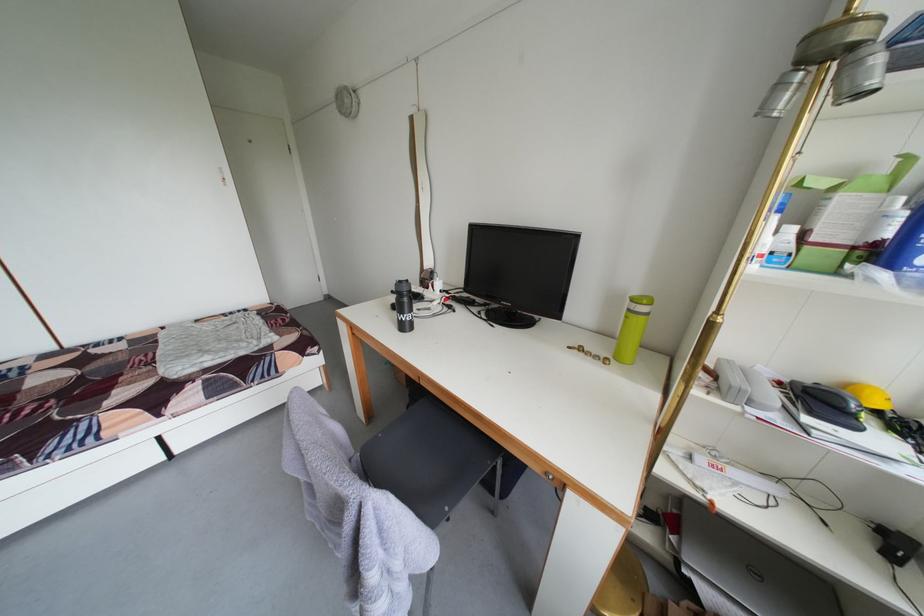
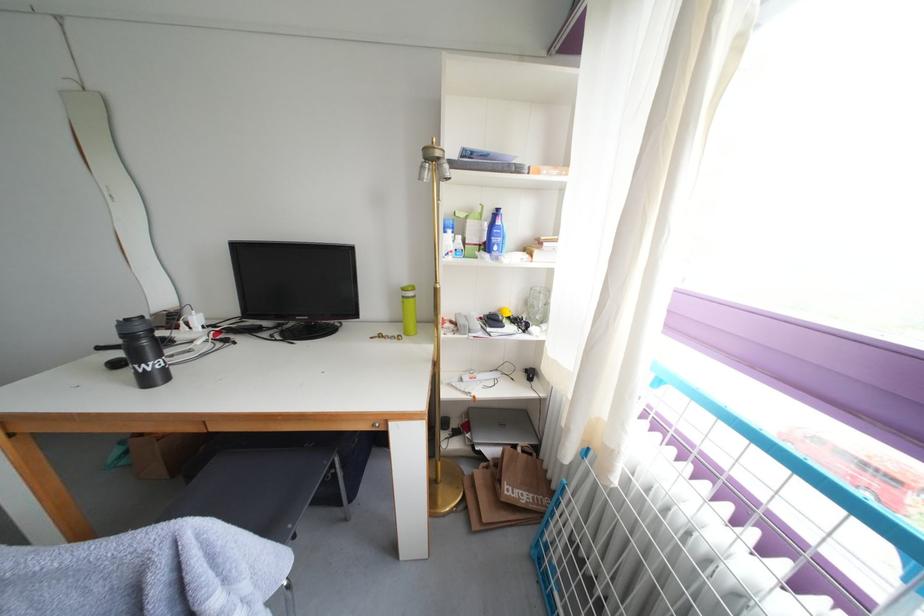
In the second image, find the point that corresponds to point 385,515 in the first image.

(208, 541)